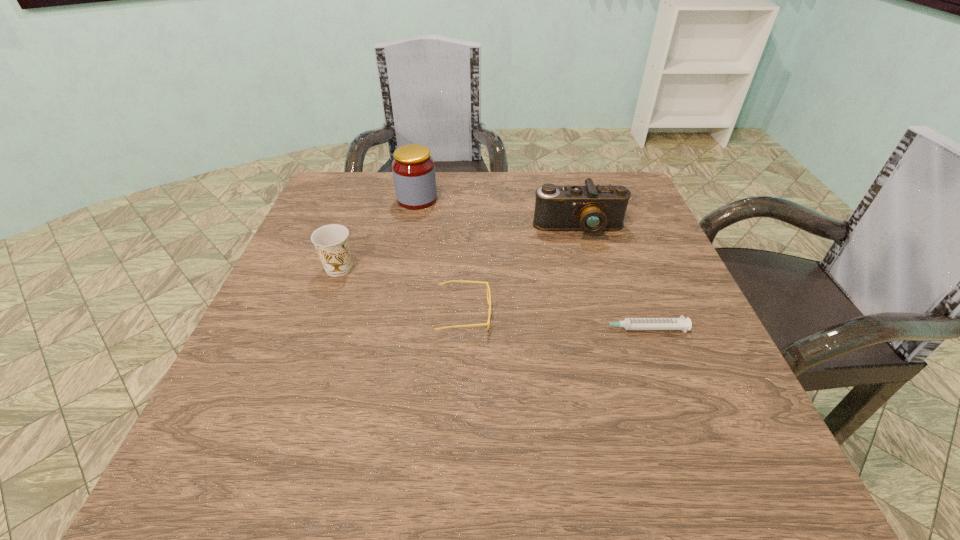
Identify the location of free space located on the lens of the fourth shortest object. The height and width of the screenshot is (540, 960). (599, 299).

Locate an element on the screen. The width and height of the screenshot is (960, 540). free region located on the front of the leftmost object is located at coordinates (323, 315).

This screenshot has height=540, width=960. Find the location of `vacant space situated 0.190m in front of the lenses of the third object from left to right`. vacant space situated 0.190m in front of the lenses of the third object from left to right is located at coordinates [588, 314].

Identify the location of free space located 0.180m at the needle end of the syringe. The height and width of the screenshot is (540, 960). (496, 329).

At what (x,y) coordinates should I click in order to perform the action: click on free space located at the needle end of the syringe. Please return your answer as a coordinate pair (x, y). Looking at the image, I should click on coord(406,329).

You are a GUI agent. You are given a task and a screenshot of the screen. Output one action in this format:
    pyautogui.click(x=<x>, y=<y>)
    Task: Click on the vacant space located 0.190m at the needle end of the syringe
    This screenshot has width=960, height=540.
    Given the screenshot: What is the action you would take?
    pyautogui.click(x=491, y=329)

At what (x,y) coordinates should I click in order to perform the action: click on jar that is at the far edge. Please return your answer as a coordinate pair (x, y). Image resolution: width=960 pixels, height=540 pixels. Looking at the image, I should click on (413, 168).

The width and height of the screenshot is (960, 540). I want to click on camera positioned at the far edge, so tap(591, 209).

You are a GUI agent. You are given a task and a screenshot of the screen. Output one action in this format:
    pyautogui.click(x=<x>, y=<y>)
    Task: Click on the object present at the left edge
    The image size is (960, 540).
    Given the screenshot: What is the action you would take?
    pyautogui.click(x=331, y=241)

At what (x,y) coordinates should I click in order to perform the action: click on camera situated at the right edge. Please return your answer as a coordinate pair (x, y). This screenshot has width=960, height=540. Looking at the image, I should click on (591, 209).